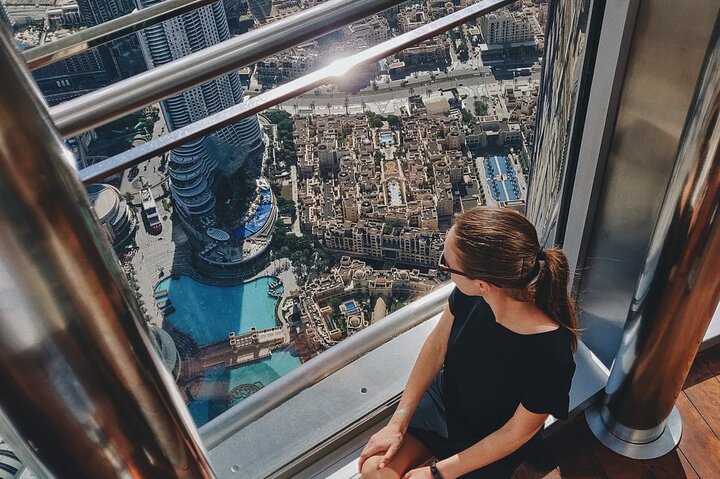
Find the location of a particular element. The width and height of the screenshot is (720, 479). window ledge is located at coordinates (228, 424), (356, 350), (425, 304), (387, 369), (256, 440).